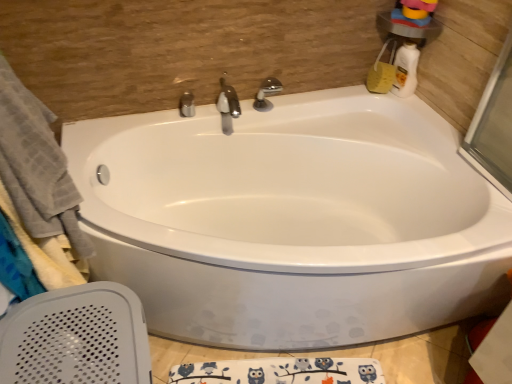
In order to click on free space in front of white glossy bottle at upper right in this screenshot , I will do `click(414, 109)`.